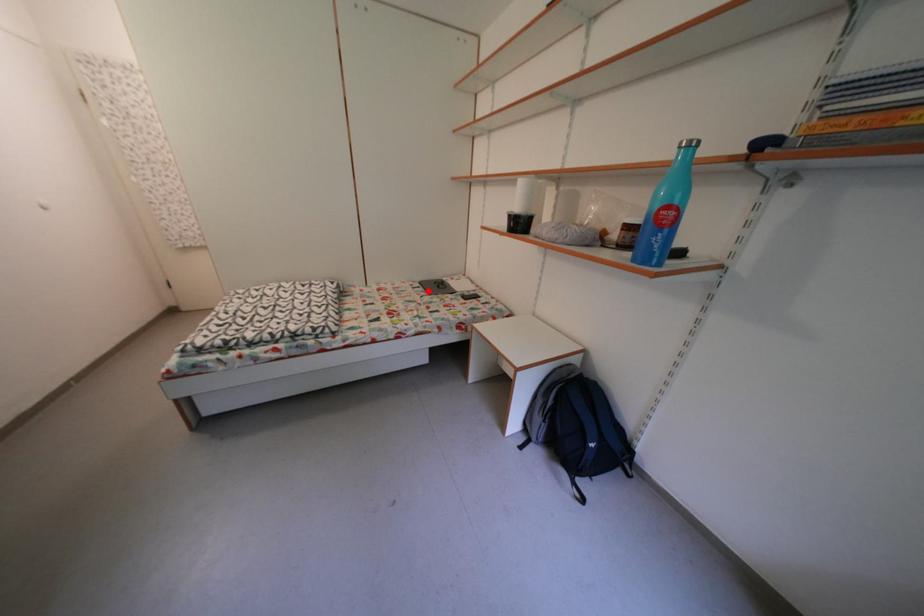
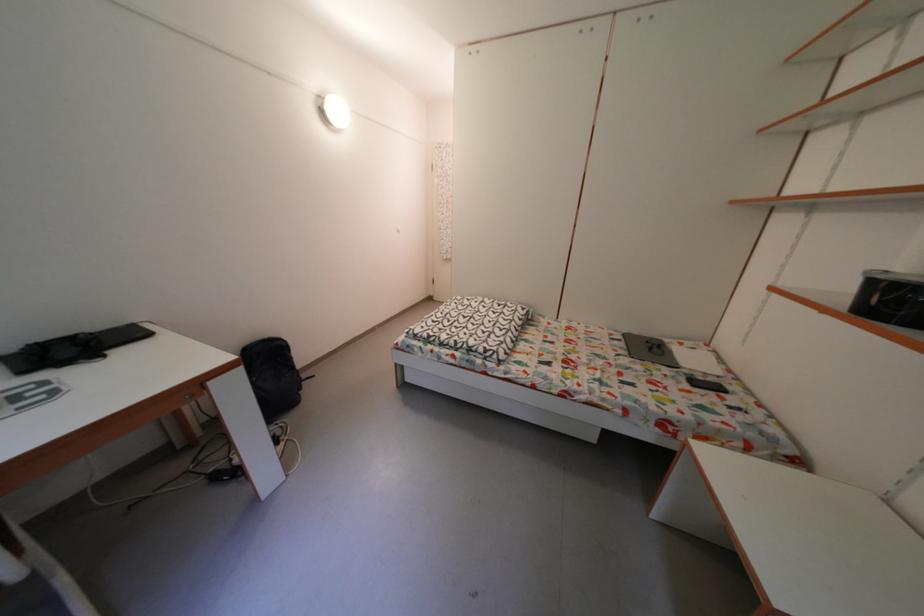
Where in the second image is the point corresponding to the highlighted location from the first image?

(629, 342)